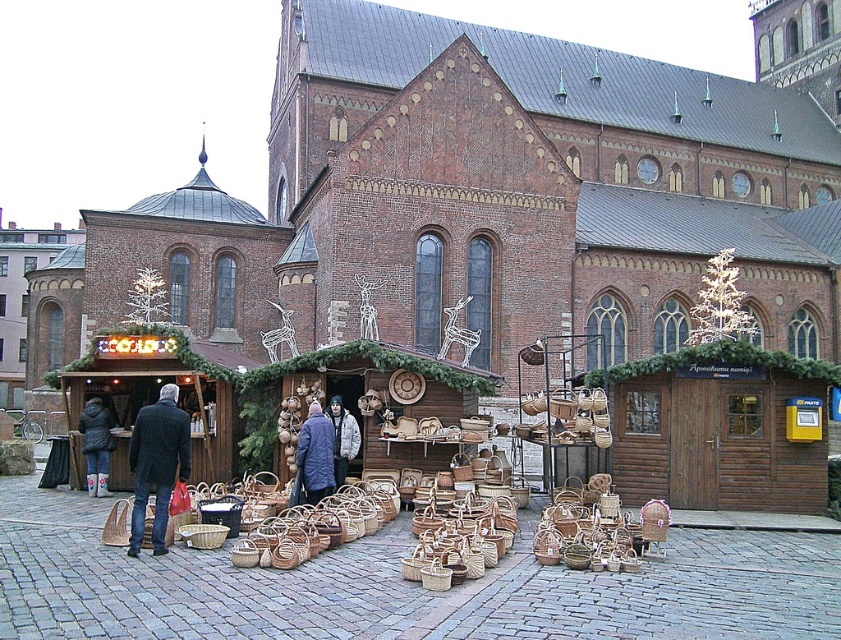
You are standing in front of the market stall at the festive market scene. There are two points marked on the stall. The first point is at coordinates point [104,468] and the second is at point [334,470]. Which point is closer to you?

Point [104,468] is further to the camera than point [334,470], so the second point is closer to you.

You are helping organize items at the market stall. You have a storage box that can only fit items narrower than the white puffy jacket at center. Can the white rubber boots at lower left fit into the box?

The white rubber boots at lower left are wider than the white puffy jacket at center, so they cannot fit into the storage box designed for items narrower than the white puffy jacket at center.